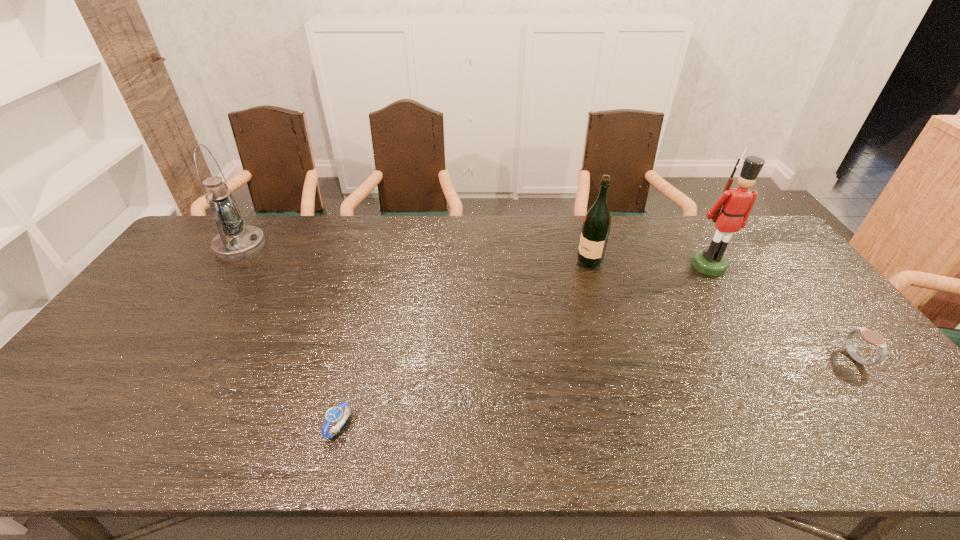
At what (x,y) coordinates should I click in order to perform the action: click on the second object from right to left. Please return your answer as a coordinate pair (x, y). Looking at the image, I should click on (738, 202).

Image resolution: width=960 pixels, height=540 pixels. What are the coordinates of `the leftmost object` in the screenshot? It's located at (236, 241).

This screenshot has height=540, width=960. I want to click on the third object from left to right, so click(596, 226).

Where is `liquor`? liquor is located at coordinates (596, 226).

Image resolution: width=960 pixels, height=540 pixels. I want to click on the second nearest object, so click(872, 337).

Identify the location of the second shortest object. (872, 337).

At what (x,y) coordinates should I click in order to perform the action: click on the nearer watch. Please return your answer as a coordinate pair (x, y). Looking at the image, I should click on (335, 414).

Locate an element on the screen. the nearest object is located at coordinates (335, 414).

You are a GUI agent. You are given a task and a screenshot of the screen. Output one action in this format:
    pyautogui.click(x=<x>, y=<y>)
    Task: Click on the free space located 0.110m on the front-facing side of the fourth object from left to right
    The width and height of the screenshot is (960, 540).
    Given the screenshot: What is the action you would take?
    pyautogui.click(x=731, y=301)

Find the location of a particular element. vacant point located 0.160m on the right of the leftmost object is located at coordinates tap(312, 246).